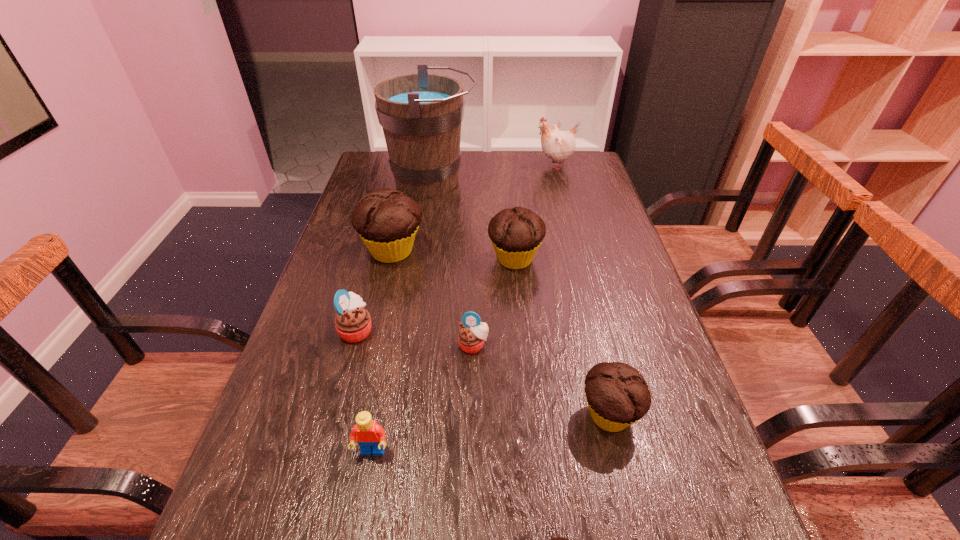
I want to click on the right pink muffin, so click(x=471, y=337).

Find the location of a particular element. The image size is (960, 540). the third muffin from left to right is located at coordinates pos(471,337).

The height and width of the screenshot is (540, 960). What are the coordinates of `vacant space situated with a handle on the side of the wine bucket` in the screenshot? It's located at (577, 181).

At what (x,y) coordinates should I click in order to perform the action: click on vacant point located 0.250m at the beak of the white bird. Please return your answer as a coordinate pair (x, y). The height and width of the screenshot is (540, 960). Looking at the image, I should click on (464, 165).

The width and height of the screenshot is (960, 540). Find the location of `free space located at the beak of the white bird`. free space located at the beak of the white bird is located at coordinates (469, 165).

Identify the location of vacant space located 0.300m at the beak of the white bird. (450, 165).

Find the location of a particular element. The width and height of the screenshot is (960, 540). vacant point located on the right of the biggest chocolate muffin is located at coordinates (510, 251).

Where is `vacant region located on the left of the fourth tallest object`? vacant region located on the left of the fourth tallest object is located at coordinates (387, 259).

Where is `free space located on the front-facing side of the bigger pink muffin`? This screenshot has width=960, height=540. free space located on the front-facing side of the bigger pink muffin is located at coordinates (470, 330).

Locate an element on the screen. vacant area situated on the back of the third farthest chocolate muffin is located at coordinates (594, 356).